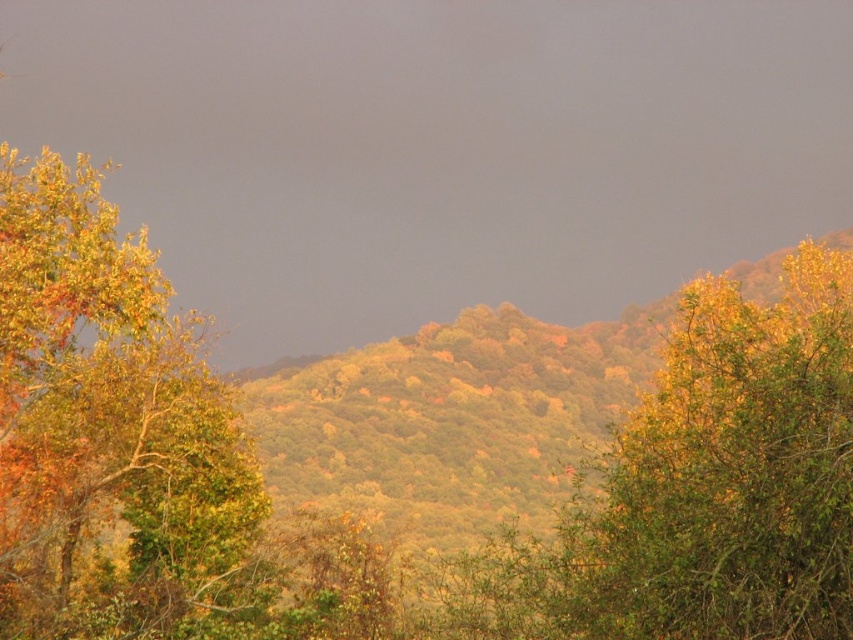
Question: Can you confirm if green leafy tree at center is bigger than golden foliage tree at left?

Choices:
 (A) no
 (B) yes

Answer: (B)

Question: Is green leafy tree at center closer to camera compared to golden foliage tree at left?

Choices:
 (A) no
 (B) yes

Answer: (B)

Question: Does green leafy tree at center appear under golden foliage tree at left?

Choices:
 (A) no
 (B) yes

Answer: (A)

Question: Which point is farther from the camera taking this photo?

Choices:
 (A) (494, 596)
 (B) (113, 275)

Answer: (B)